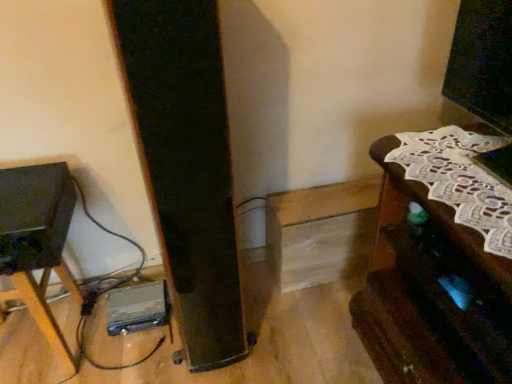
Question: Is matte black speaker at left closer to camera compared to metallic silver tripod at lower left, the 1th furniture positioned from the left?

Choices:
 (A) yes
 (B) no

Answer: (A)

Question: Is matte black speaker at left facing away from metallic silver tripod at lower left, the 2th furniture viewed from the right?

Choices:
 (A) yes
 (B) no

Answer: (B)

Question: Does matte black speaker at left touch metallic silver tripod at lower left, the 2th furniture viewed from the right?

Choices:
 (A) no
 (B) yes

Answer: (B)

Question: Can you confirm if matte black speaker at left is shorter than metallic silver tripod at lower left, the 1th furniture positioned from the left?

Choices:
 (A) no
 (B) yes

Answer: (B)

Question: Considering the relative sizes of matte black speaker at left and metallic silver tripod at lower left, the 2th furniture viewed from the right, in the image provided, is matte black speaker at left wider than metallic silver tripod at lower left, the 2th furniture viewed from the right,?

Choices:
 (A) yes
 (B) no

Answer: (A)

Question: Is matte black speaker at left further to camera compared to metallic silver tripod at lower left, the 1th furniture positioned from the left?

Choices:
 (A) yes
 (B) no

Answer: (B)

Question: From the image's perspective, is matte black speaker at left under brown wooden table at right, the first furniture positioned from the right?

Choices:
 (A) no
 (B) yes

Answer: (A)

Question: Does matte black speaker at left turn towards brown wooden table at right, which is the second furniture from left to right?

Choices:
 (A) yes
 (B) no

Answer: (B)

Question: Is brown wooden table at right, the first furniture positioned from the right, surrounded by matte black speaker at left?

Choices:
 (A) yes
 (B) no

Answer: (B)

Question: Is matte black speaker at left positioned before brown wooden table at right, the first furniture positioned from the right?

Choices:
 (A) no
 (B) yes

Answer: (A)

Question: From the image's perspective, is matte black speaker at left over brown wooden table at right, the first furniture positioned from the right?

Choices:
 (A) no
 (B) yes

Answer: (B)

Question: Can you confirm if matte black speaker at left is wider than brown wooden table at right, the first furniture positioned from the right?

Choices:
 (A) no
 (B) yes

Answer: (A)

Question: Does brown wooden table at right, which is the second furniture from left to right, lie behind matte black speaker at left?

Choices:
 (A) yes
 (B) no

Answer: (B)